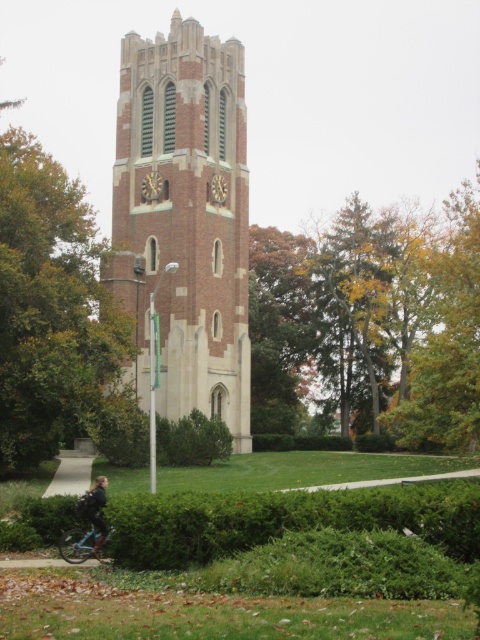
Question: Which object is closer to the camera taking this photo?

Choices:
 (A) yellow-green leaves at upper right
 (B) green leafy tree at left
 (C) teal matte bicycle at lower left
 (D) brick tower at center

Answer: (C)

Question: Which is nearer to the green leafy tree at left?

Choices:
 (A) brick tower at center
 (B) green leafy tree at center
 (C) teal matte bicycle at lower left

Answer: (A)

Question: Does brick tower at center appear over yellow-green leaves at upper right?

Choices:
 (A) yes
 (B) no

Answer: (A)

Question: Can you confirm if brick tower at center is positioned below green leafy tree at left?

Choices:
 (A) no
 (B) yes

Answer: (B)

Question: Observing the image, what is the correct spatial positioning of green leafy tree at center in reference to brick tower at center?

Choices:
 (A) below
 (B) above

Answer: (A)

Question: Which object is the farthest from the green leafy tree at center?

Choices:
 (A) green leafy tree at left
 (B) yellow-green leaves at upper right
 (C) teal matte bicycle at lower left

Answer: (C)